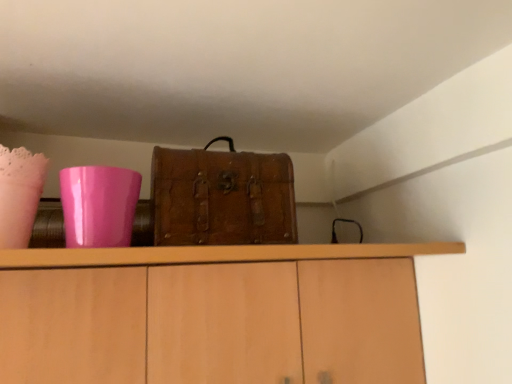
The height and width of the screenshot is (384, 512). What do you see at coordinates (222, 197) in the screenshot? I see `leather suitcase at center` at bounding box center [222, 197].

Identify the location of leather suitcase at center. (222, 197).

Measure the distance between point (153, 183) and camera.

They are 34.33 inches apart.

I want to click on leather suitcase at center, so click(222, 197).